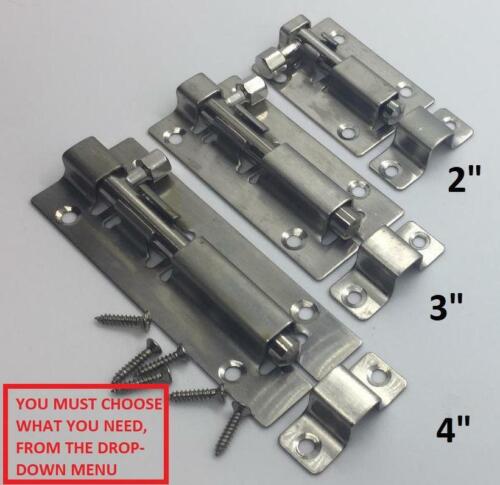
Locate an element on the screen. locks is located at coordinates (208, 285), (286, 176), (372, 95).